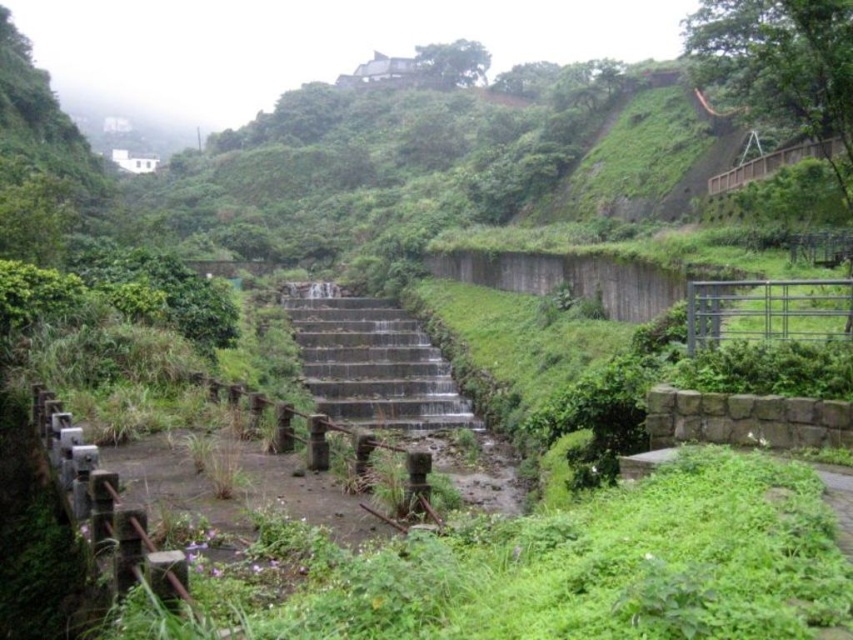
Question: Considering the real-world distances, which object is farthest from the gray concrete stairs at center?

Choices:
 (A) metallic silver rail at right
 (B) rusty metal rail at center

Answer: (B)

Question: Does gray concrete stairs at center appear on the right side of metallic silver rail at right?

Choices:
 (A) yes
 (B) no

Answer: (B)

Question: Which point is closer to the camera taking this photo?

Choices:
 (A) (285, 435)
 (B) (792, 291)

Answer: (A)

Question: Which point appears closest to the camera in this image?

Choices:
 (A) (276, 413)
 (B) (770, 316)

Answer: (A)

Question: Is gray concrete stairs at center closer to camera compared to metallic silver rail at right?

Choices:
 (A) no
 (B) yes

Answer: (A)

Question: Considering the relative positions of gray concrete stairs at center and rusty metal rail at center in the image provided, where is gray concrete stairs at center located with respect to rusty metal rail at center?

Choices:
 (A) right
 (B) left

Answer: (B)